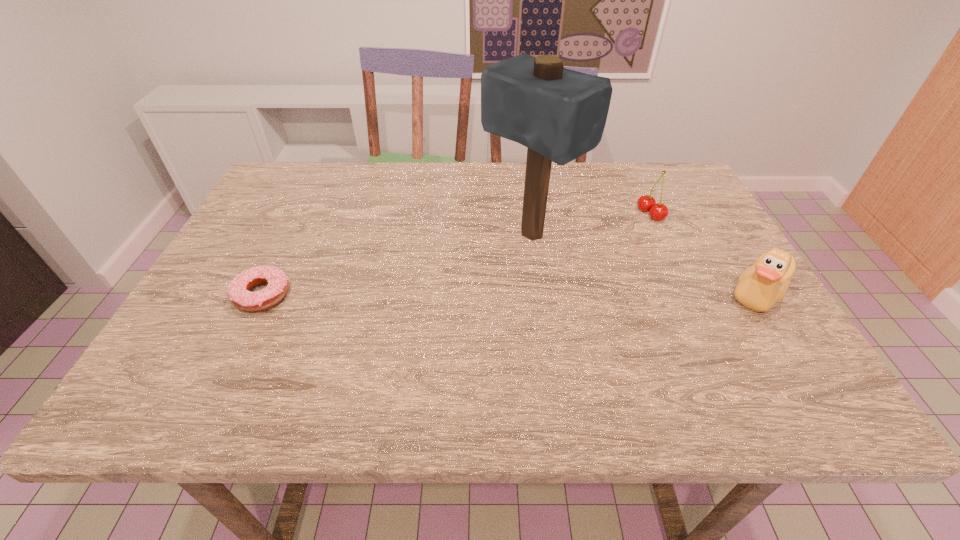
Locate an element on the screen. The height and width of the screenshot is (540, 960). free space located with the stems of the cherry pointing upwards is located at coordinates (561, 254).

Where is `vacant point located 0.180m with the stems of the cherry pointing upwards`? vacant point located 0.180m with the stems of the cherry pointing upwards is located at coordinates (589, 242).

You are a GUI agent. You are given a task and a screenshot of the screen. Output one action in this format:
    pyautogui.click(x=<x>, y=<y>)
    Task: Click on the vacant space situated 0.370m with the stems of the cherry pointing upwards
    This screenshot has height=540, width=960.
    Given the screenshot: What is the action you would take?
    pyautogui.click(x=527, y=269)

In order to click on free space located 0.130m on the striking surface of the mallet in this screenshot , I will do `click(456, 285)`.

At what (x,y) coordinates should I click in order to perform the action: click on vacant region located on the striking surface of the mallet. Please return your answer as a coordinate pair (x, y). This screenshot has width=960, height=540. Looking at the image, I should click on (387, 332).

Find the location of `free space located on the striking surface of the mallet`. free space located on the striking surface of the mallet is located at coordinates (421, 308).

The height and width of the screenshot is (540, 960). Find the location of `cherry positioned at the far edge`. cherry positioned at the far edge is located at coordinates (646, 203).

This screenshot has width=960, height=540. In order to click on mallet positioned at the far edge in this screenshot , I will do `click(559, 114)`.

The image size is (960, 540). Identify the location of object at the left edge. (239, 292).

The image size is (960, 540). Find the location of `duck that is positioned at the right edge`. duck that is positioned at the right edge is located at coordinates (760, 286).